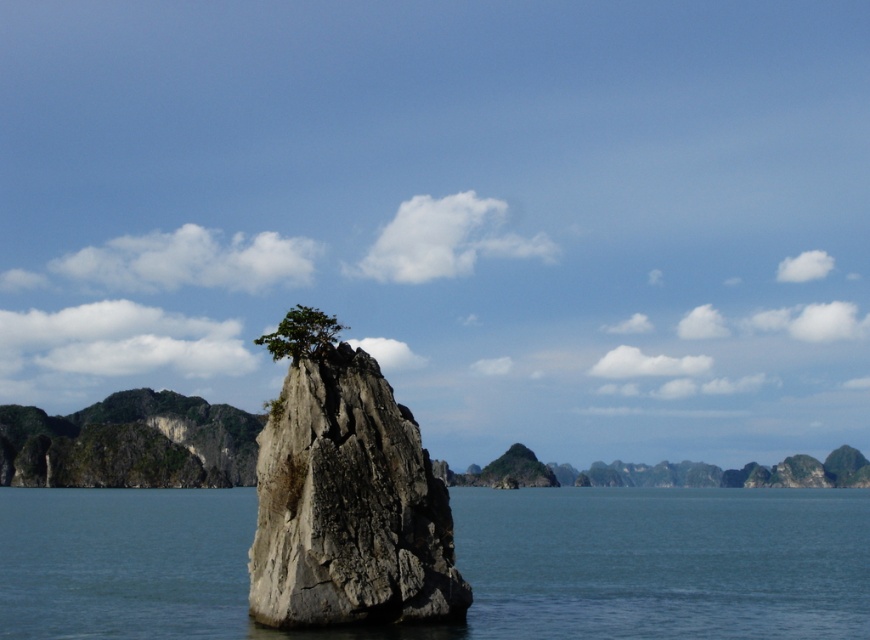
You are standing on the shore of the bay and see the clear blue water at center and the gray rough rock at center. Which object is located to the right of the other?

The clear blue water at center is positioned on the right side of gray rough rock at center.

You are a photographer planning to capture the entire scene in one shot. Given that your camera can only focus on objects within a 100cm width, and the gray rough rock at center is 30cm wide, will the clear blue water at center fit entirely within the camera frame?

The clear blue water at center is bigger than the gray rough rock at center, which is 30cm wide. Since the water is larger, it exceeds the camera frame limit of 100cm, so it won not fit entirely.

You are a photographer planning to capture the entire scene in one shot. Given that the clear blue water at center and the green leafy tree at center are both in the frame, which object will occupy more of the photo?

The clear blue water at center is bigger than the green leafy tree at center, so it will occupy more space in the photo.